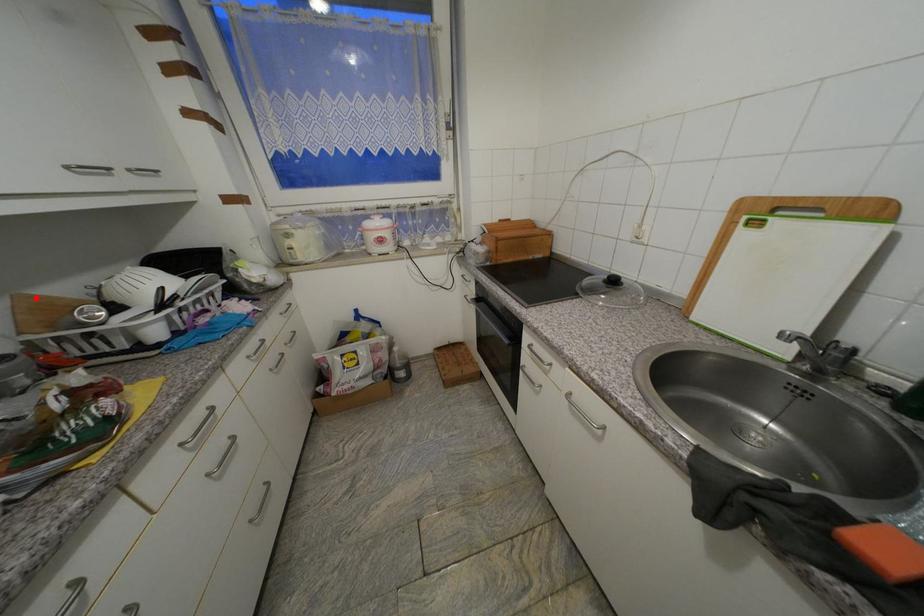
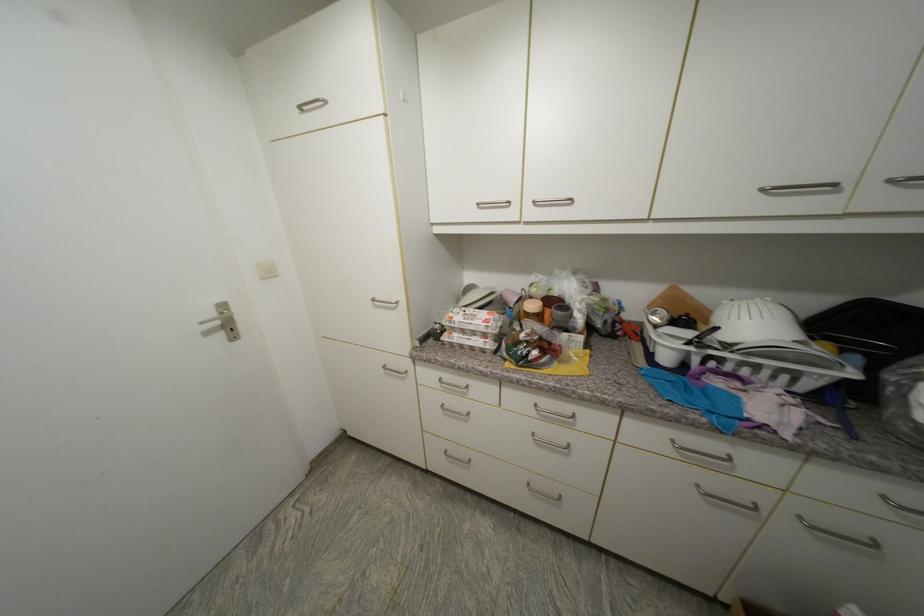
Find the pixel in the second image that matches the highlighted location in the first image.

(685, 292)